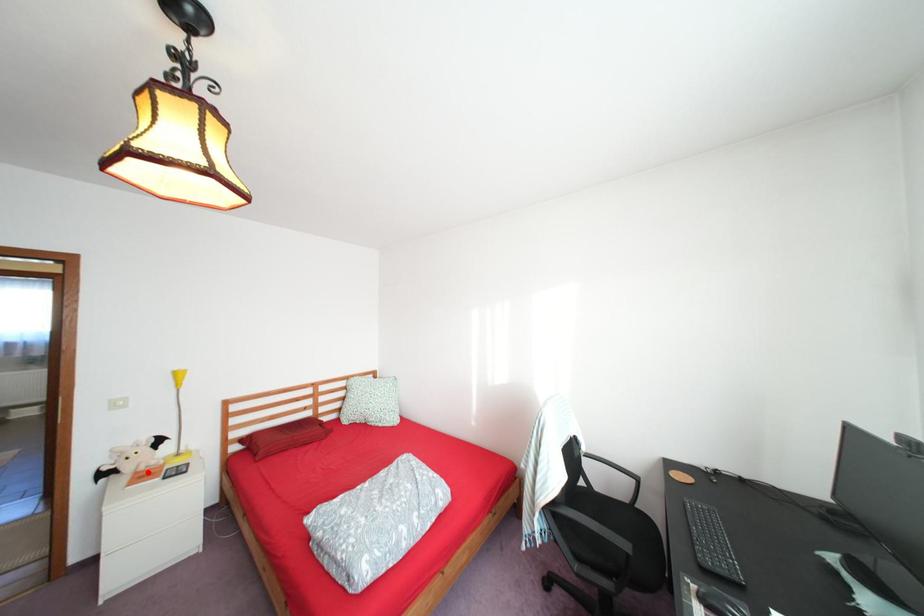
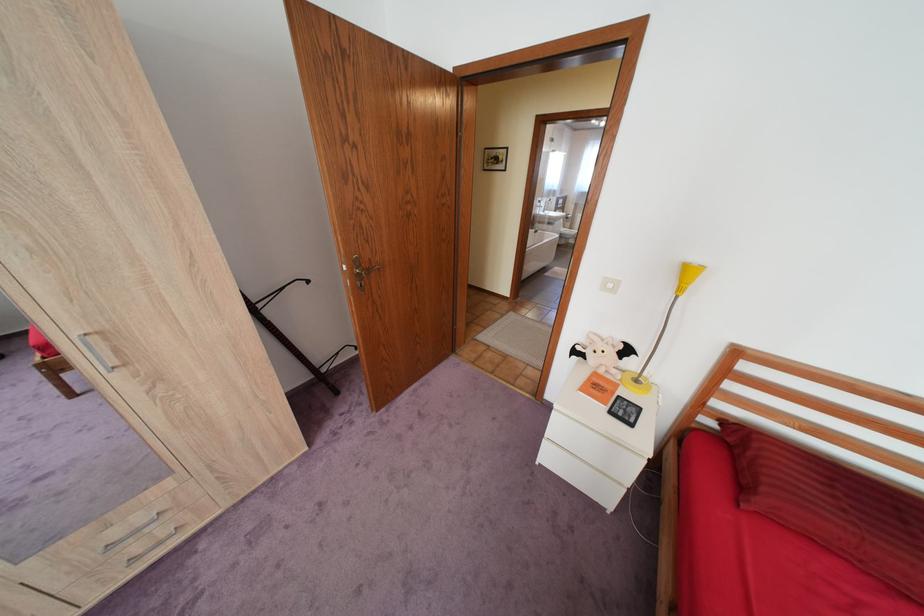
The point at the highlighted location is marked in the first image. Where is the corresponding point in the second image?

(606, 373)